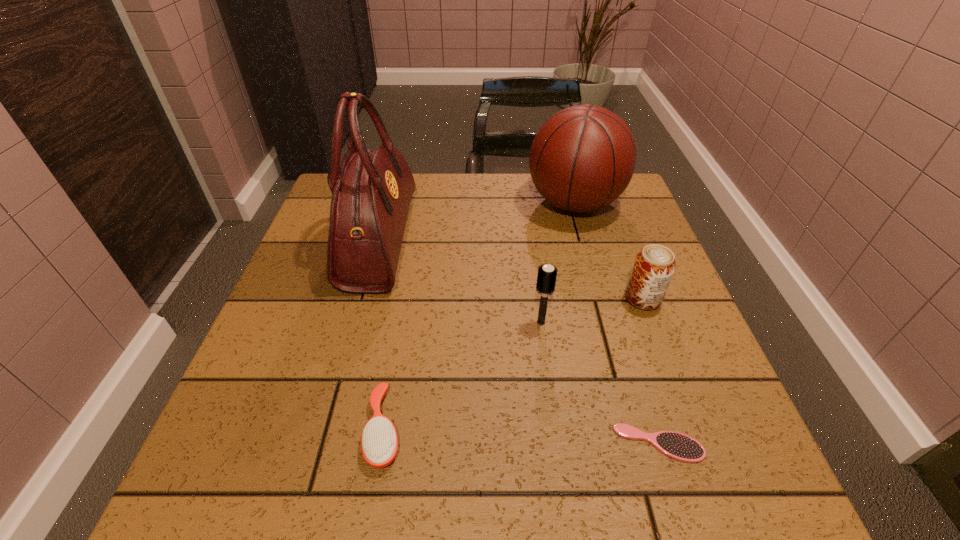
Locate an element on the screen. The height and width of the screenshot is (540, 960). the tallest object is located at coordinates (371, 190).

Locate an element on the screen. This screenshot has height=540, width=960. basketball is located at coordinates (582, 159).

Locate an element on the screen. the third nearest object is located at coordinates (546, 279).

Find the location of a particular element. The height and width of the screenshot is (540, 960). the second hairbrush from right to left is located at coordinates (546, 279).

The height and width of the screenshot is (540, 960). In order to click on the fourth tallest object in this screenshot , I will do `click(654, 266)`.

Find the location of a particular element. This screenshot has height=540, width=960. the second shortest object is located at coordinates (379, 442).

Where is `the second shortest hairbrush`? the second shortest hairbrush is located at coordinates (379, 442).

You are a GUI agent. You are given a task and a screenshot of the screen. Output one action in this format:
    pyautogui.click(x=<x>, y=<y>)
    Task: Click on the shortest object
    The width and height of the screenshot is (960, 540).
    Given the screenshot: What is the action you would take?
    pyautogui.click(x=676, y=445)

The image size is (960, 540). Find the location of `the rightmost hairbrush`. the rightmost hairbrush is located at coordinates (676, 445).

In order to click on vacant area situated on the front-facing side of the tallest object in this screenshot , I will do `click(566, 240)`.